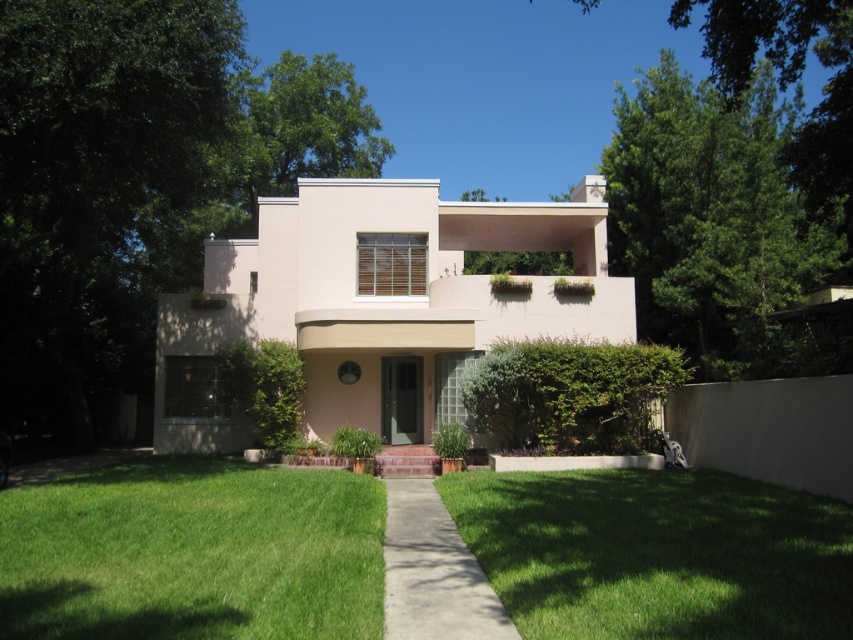
Between point (281, 493) and point (618, 568), which one is positioned in front?

Positioned in front is point (618, 568).

What do you see at coordinates (192, 554) in the screenshot? The image size is (853, 640). I see `green grass at lower left` at bounding box center [192, 554].

Between point (358, 570) and point (529, 632), which one is positioned behind?

The point (358, 570) is behind.

Where is `green grass at lower left`? The height and width of the screenshot is (640, 853). green grass at lower left is located at coordinates click(192, 554).

You are a GUI agent. You are given a task and a screenshot of the screen. Output one action in this format:
    pyautogui.click(x=<x>, y=<y>)
    Task: Click on the green leafy tree at upper right
    The image size is (853, 640).
    Given the screenshot: What is the action you would take?
    pyautogui.click(x=720, y=225)

Does green leafy tree at upper right appear on the left side of concrete at center?

In fact, green leafy tree at upper right is to the right of concrete at center.

The image size is (853, 640). What are the coordinates of `green leafy tree at upper right` in the screenshot? It's located at (720, 225).

Is green leafy tree at left to the left of green leafy tree at upper right from the viewer's perspective?

Correct, you'll find green leafy tree at left to the left of green leafy tree at upper right.

Who is taller, green leafy tree at left or green leafy tree at upper right?

Standing taller between the two is green leafy tree at upper right.

Describe the element at coordinates (97, 189) in the screenshot. Image resolution: width=853 pixels, height=640 pixels. I see `green leafy tree at left` at that location.

I want to click on green leafy tree at left, so click(97, 189).